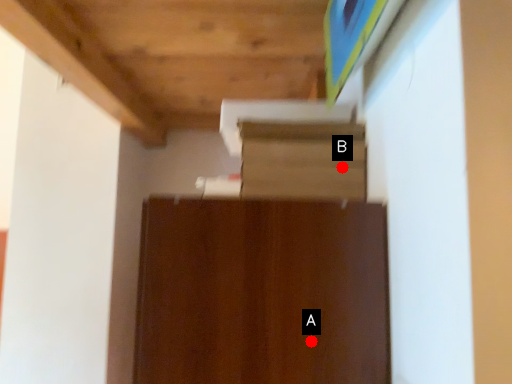
Question: Two points are circled on the image, labeled by A and B beside each circle. Which point appears closest to the camera in this image?

Choices:
 (A) A is closer
 (B) B is closer

Answer: (A)